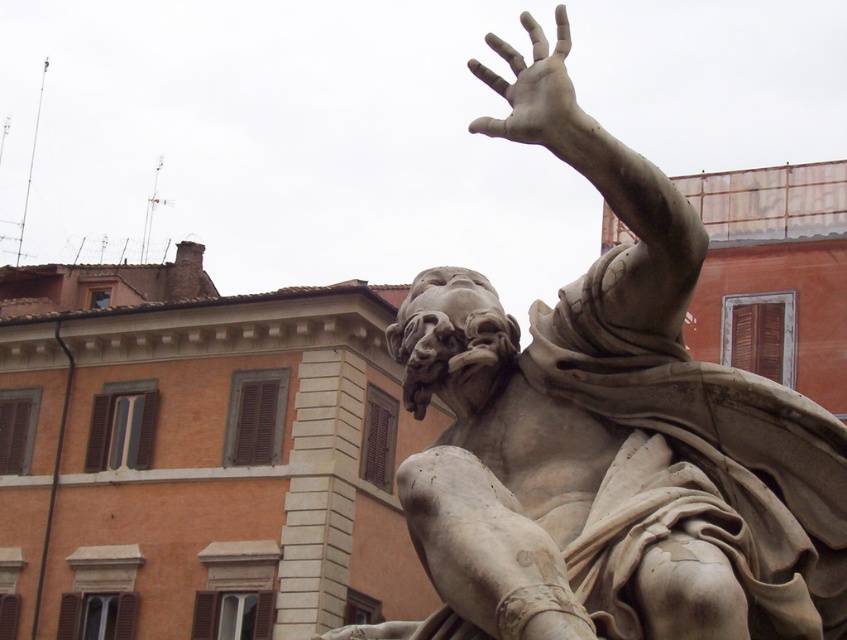
Measure the distance between white marble statue at upper right and smooth stone hand at upper right.

white marble statue at upper right and smooth stone hand at upper right are 24.44 feet apart from each other.

Can you confirm if white marble statue at upper right is positioned to the right of smooth stone hand at upper right?

In fact, white marble statue at upper right is to the left of smooth stone hand at upper right.

Between point (674, 243) and point (583, 138), which one is positioned behind?

Point (674, 243)

Image resolution: width=847 pixels, height=640 pixels. I want to click on white marble statue at upper right, so click(612, 456).